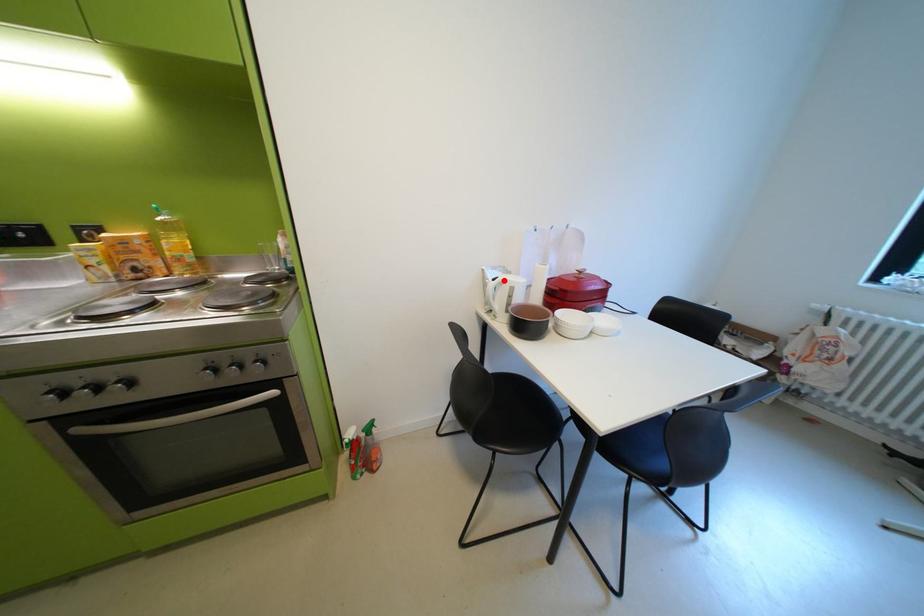
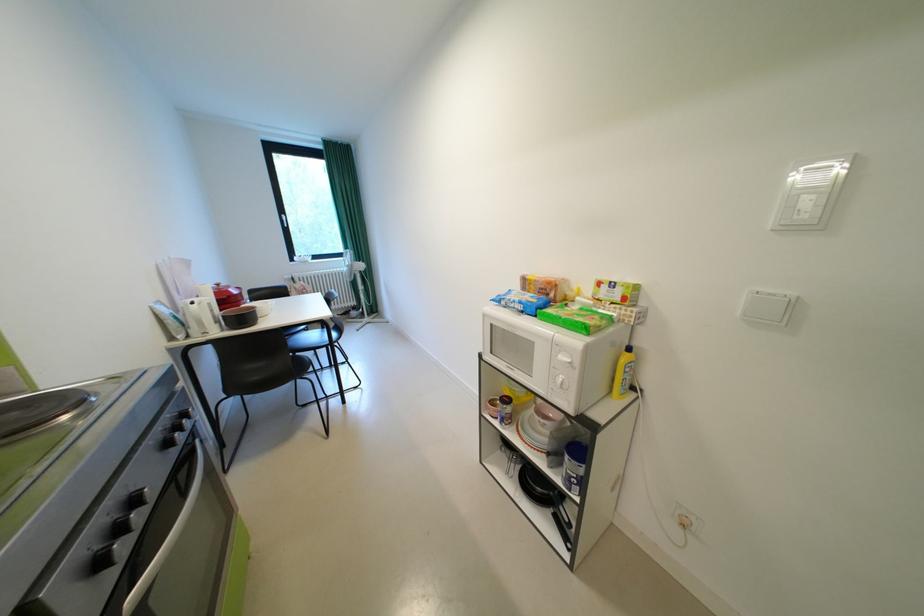
In the second image, find the point that corresponds to the highlighted location in the first image.

(203, 304)